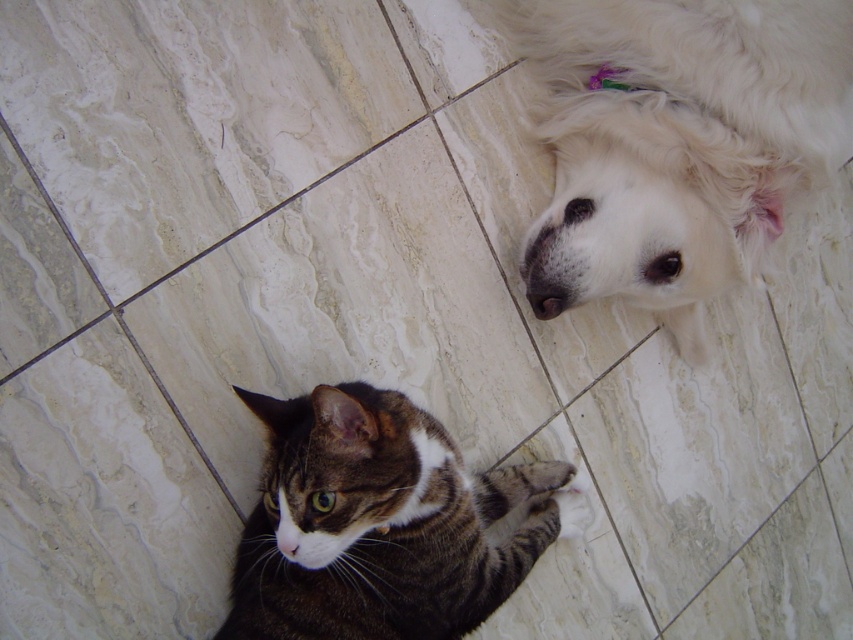
Which is more to the left, white fluffy dog at upper right or tabby fur cat at lower left?

tabby fur cat at lower left is more to the left.

Between point (662, 28) and point (367, 429), which one is positioned in front?

Point (367, 429) is more forward.

At what (x,y) coordinates should I click in order to perform the action: click on white fluffy dog at upper right. Please return your answer as a coordinate pair (x, y). The width and height of the screenshot is (853, 640). Looking at the image, I should click on (677, 141).

This screenshot has width=853, height=640. I want to click on white fluffy dog at upper right, so click(x=677, y=141).